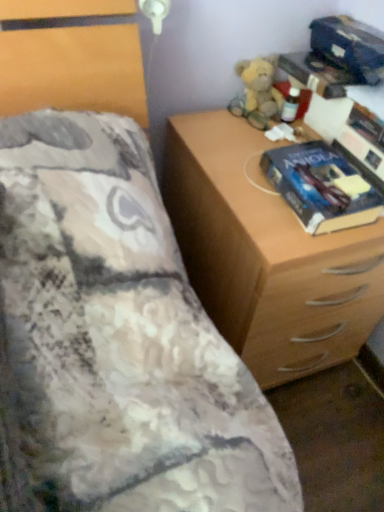
The width and height of the screenshot is (384, 512). I want to click on free point to the left of blue glossy paperback book at right, so click(240, 181).